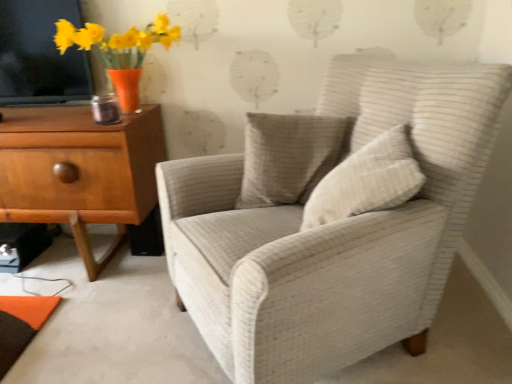
Question: Is light brown wood chest of drawers at left bigger than textured beige pillow at center, which is the 1th pillow from back to front?

Choices:
 (A) yes
 (B) no

Answer: (A)

Question: Does light brown wood chest of drawers at left have a lesser height compared to textured beige pillow at center, which is the 1th pillow from back to front?

Choices:
 (A) yes
 (B) no

Answer: (B)

Question: Does light brown wood chest of drawers at left have a lesser width compared to textured beige pillow at center, which is the 1th pillow from back to front?

Choices:
 (A) no
 (B) yes

Answer: (A)

Question: Does light brown wood chest of drawers at left have a greater height compared to textured beige pillow at center, which is the 1th pillow from back to front?

Choices:
 (A) no
 (B) yes

Answer: (B)

Question: Is light brown wood chest of drawers at left at the right side of textured beige pillow at center, which is the 1th pillow from back to front?

Choices:
 (A) no
 (B) yes

Answer: (A)

Question: Does light brown wood chest of drawers at left appear on the left side of textured beige pillow at center, which ranks as the second pillow in front-to-back order?

Choices:
 (A) yes
 (B) no

Answer: (A)

Question: Can we say beige textured pillow at center, which ranks as the 2th pillow in back-to-front order, lies outside matte orange vase with yellow flowers at upper left?

Choices:
 (A) yes
 (B) no

Answer: (A)

Question: Is beige textured pillow at center, which ranks as the 2th pillow in back-to-front order, in front of matte orange vase with yellow flowers at upper left?

Choices:
 (A) no
 (B) yes

Answer: (B)

Question: Is beige textured pillow at center, which appears as the first pillow when viewed from the front, further to camera compared to matte orange vase with yellow flowers at upper left?

Choices:
 (A) no
 (B) yes

Answer: (A)

Question: Does beige textured pillow at center, which ranks as the 2th pillow in back-to-front order, have a smaller size compared to matte orange vase with yellow flowers at upper left?

Choices:
 (A) no
 (B) yes

Answer: (B)

Question: From a real-world perspective, is beige textured pillow at center, which appears as the first pillow when viewed from the front, physically above matte orange vase with yellow flowers at upper left?

Choices:
 (A) no
 (B) yes

Answer: (A)

Question: Is beige textured pillow at center, which ranks as the 2th pillow in back-to-front order, far from matte orange vase with yellow flowers at upper left?

Choices:
 (A) no
 (B) yes

Answer: (B)

Question: Is textured beige pillow at center, which is the 1th pillow from back to front, far from beige textured pillow at center, which ranks as the 2th pillow in back-to-front order?

Choices:
 (A) no
 (B) yes

Answer: (A)